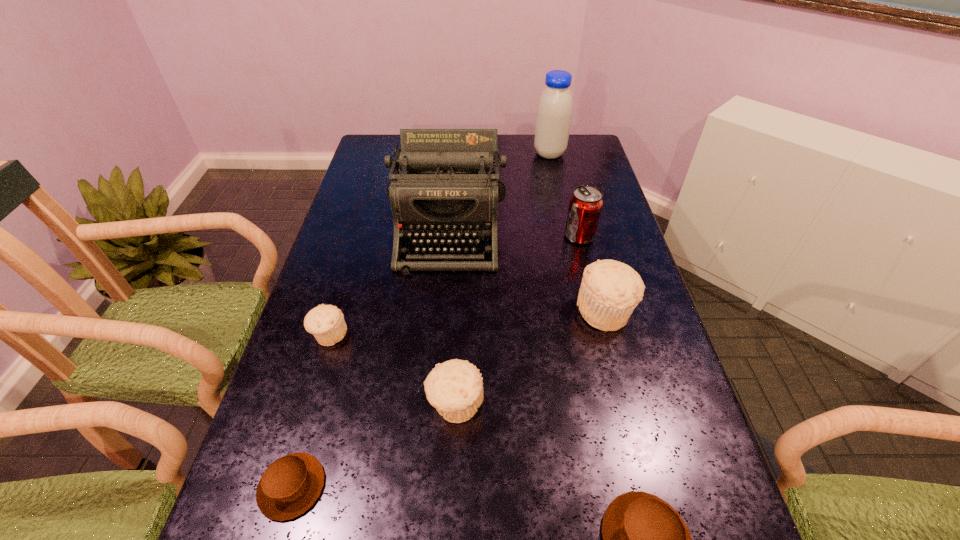
Find the location of a particular element. blank region between the shortest muffin and the typewriter is located at coordinates (370, 357).

Where is `free spot between the smallest beige muffin and the shortest object`? The height and width of the screenshot is (540, 960). free spot between the smallest beige muffin and the shortest object is located at coordinates (311, 411).

You are a GUI agent. You are given a task and a screenshot of the screen. Output one action in this format:
    pyautogui.click(x=<x>, y=<y>)
    Task: Click on the free spot between the blue soya milk and the left brown muffin
    
    Given the screenshot: What is the action you would take?
    pyautogui.click(x=420, y=320)

Image resolution: width=960 pixels, height=540 pixels. I want to click on the fourth closest object relative to the tallest muffin, so click(x=645, y=539).

Identify which object is located as the fifth nearest to the tallest muffin. Please provide its 2D coordinates. Your answer should be formatted as a tuple, i.e. [(x, y)], where the tuple contains the x and y coordinates of a point satisfying the conditions above.

[(326, 322)]

Identify the location of muffin that is the second nearest to the typewriter. Image resolution: width=960 pixels, height=540 pixels. (610, 290).

Find the location of a particular element. Image resolution: width=960 pixels, height=540 pixels. the second closest muffin to the second beige muffin from left to right is located at coordinates (326, 322).

Identify which beige muffin is the nearest to the second biggest beige muffin. Please provide its 2D coordinates. Your answer should be formatted as a tuple, i.e. [(x, y)], where the tuple contains the x and y coordinates of a point satisfying the conditions above.

[(326, 322)]

I want to click on beige muffin that can be found as the closest to the right brown muffin, so click(455, 388).

This screenshot has height=540, width=960. Find the location of `brown muffin that stands as the second closest to the tallest muffin`. brown muffin that stands as the second closest to the tallest muffin is located at coordinates tap(290, 485).